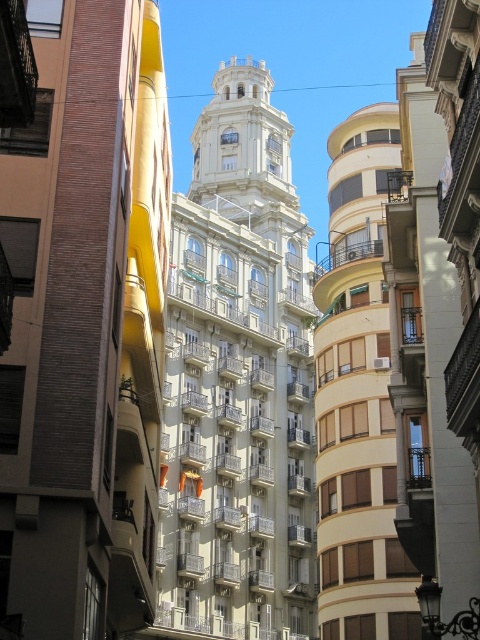
Question: Can you confirm if beige textured building at center is bigger than smooth beige balcony at right?

Choices:
 (A) yes
 (B) no

Answer: (A)

Question: Estimate the real-world distances between objects in this image. Which object is closer to the smooth beige balcony at right?

Choices:
 (A) beige textured building at center
 (B) white textured building at center

Answer: (A)

Question: Does white textured building at center appear under beige textured building at center?

Choices:
 (A) yes
 (B) no

Answer: (B)

Question: Does white textured building at center have a smaller size compared to smooth beige balcony at right?

Choices:
 (A) yes
 (B) no

Answer: (B)

Question: Which of the following is the farthest from the observer?

Choices:
 (A) beige textured building at center
 (B) white textured building at center

Answer: (B)

Question: Which of the following is the farthest from the observer?

Choices:
 (A) (239, 67)
 (B) (479, 614)

Answer: (A)